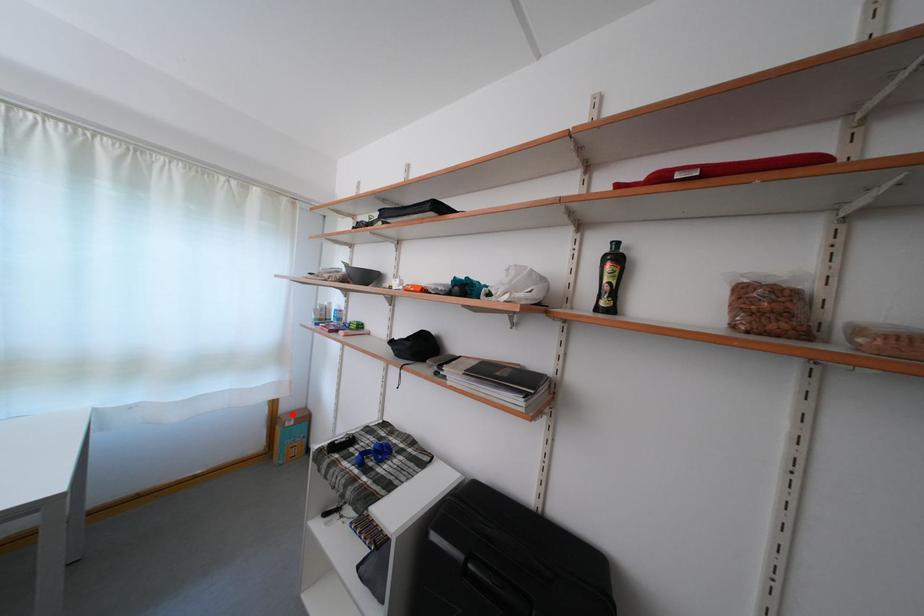
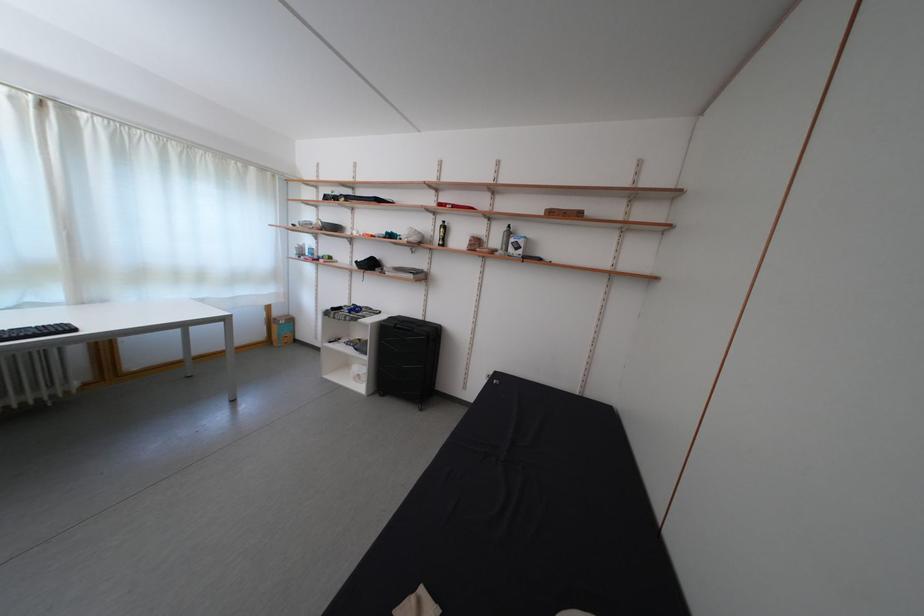
In the second image, find the point that corresponds to the highlighted location in the first image.

(285, 320)